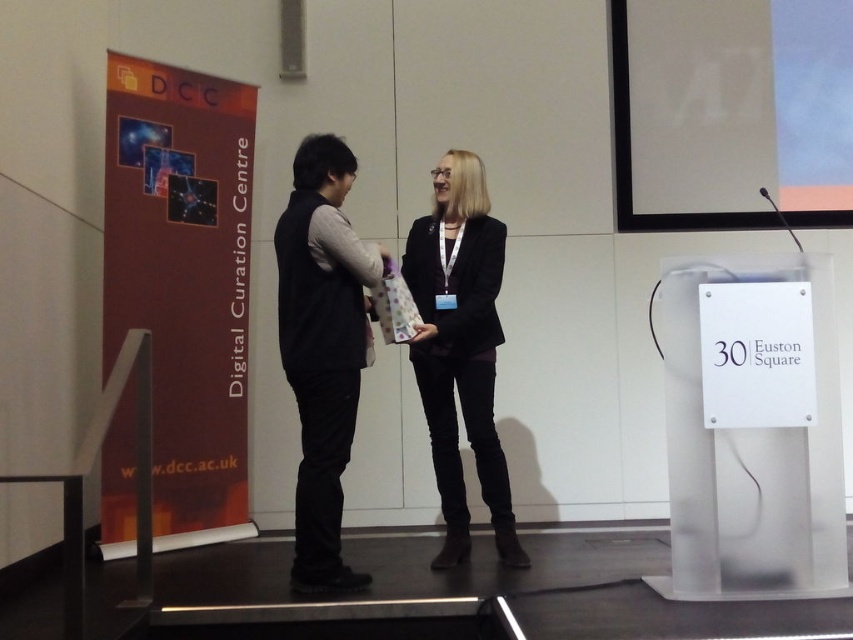
Question: Does black matte vest at center appear under black matte blazer at center?

Choices:
 (A) no
 (B) yes

Answer: (B)

Question: Which of the following is the closest to the observer?

Choices:
 (A) black matte vest at center
 (B) black matte blazer at center

Answer: (A)

Question: Which object is closer to the camera taking this photo?

Choices:
 (A) black matte blazer at center
 (B) black matte vest at center

Answer: (B)

Question: Which point is farther from the camera taking this photo?

Choices:
 (A) (469, 243)
 (B) (325, 332)

Answer: (A)

Question: Does black matte vest at center appear on the left side of black matte blazer at center?

Choices:
 (A) no
 (B) yes

Answer: (B)

Question: Is black matte vest at center wider than black matte blazer at center?

Choices:
 (A) no
 (B) yes

Answer: (A)